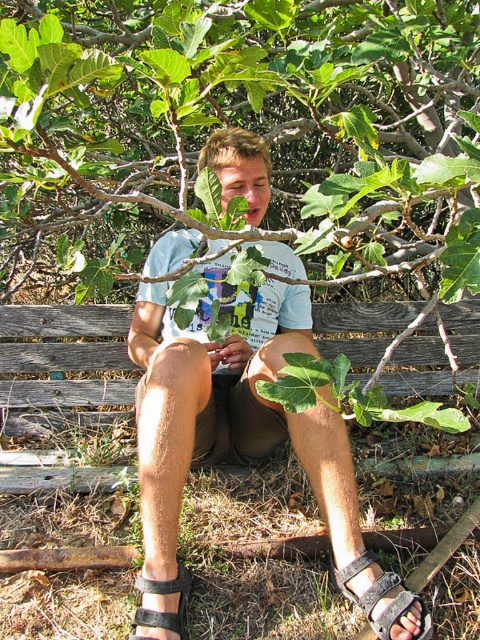
Question: Estimate the real-world distances between objects in this image. Which object is closer to the light blue t-shirt at center?

Choices:
 (A) weathered wood park bench at lower center
 (B) green leafy tree at center
 (C) black leather sandal at lower center
 (D) black suede sandal at lower center

Answer: (D)

Question: Which object is the closest to the green leafy tree at center?

Choices:
 (A) black leather sandal at lower center
 (B) weathered wood park bench at lower center
 (C) black suede sandal at lower center

Answer: (B)

Question: Where is green leafy tree at center located in relation to black suede sandal at lower center in the image?

Choices:
 (A) below
 (B) above

Answer: (B)

Question: Can you confirm if green leafy tree at center is smaller than black leather sandal at lower center?

Choices:
 (A) yes
 (B) no

Answer: (B)

Question: Which point is closer to the camera?

Choices:
 (A) light blue t-shirt at center
 (B) black suede sandal at lower center
 (C) green leafy tree at center

Answer: (C)

Question: Does black suede sandal at lower center appear under black leather sandal at lower center?

Choices:
 (A) yes
 (B) no

Answer: (B)